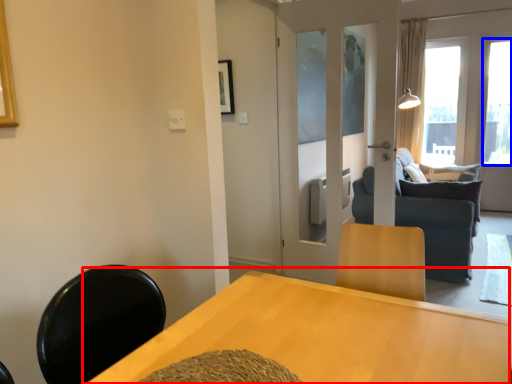
Question: Which object is closer to the camera taking this photo, table (highlighted by a red box) or window (highlighted by a blue box)?

Choices:
 (A) table
 (B) window

Answer: (A)